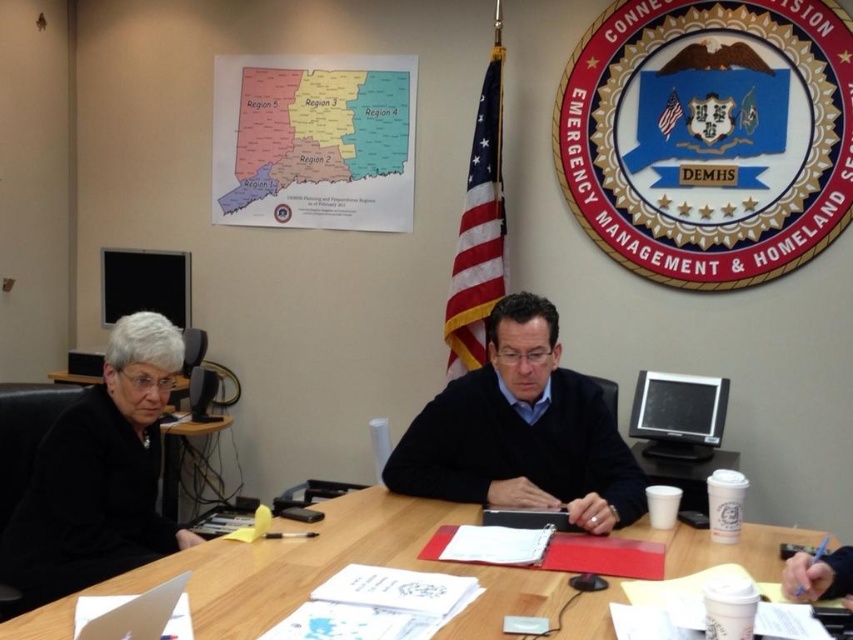
Can you confirm if black matte jacket at left is shorter than black plastic table at lower left?

Correct, black matte jacket at left is not as tall as black plastic table at lower left.

Image resolution: width=853 pixels, height=640 pixels. What do you see at coordinates (99, 474) in the screenshot? I see `black matte jacket at left` at bounding box center [99, 474].

Identify the location of black matte jacket at left. The height and width of the screenshot is (640, 853). (99, 474).

You are a GUI agent. You are given a task and a screenshot of the screen. Output one action in this format:
    pyautogui.click(x=<x>, y=<y>)
    Task: Click on the black matte jacket at left
    This screenshot has width=853, height=640.
    Given the screenshot: What is the action you would take?
    pyautogui.click(x=99, y=474)

Does point (775, 536) come in front of point (22, 600)?

No, it is behind (22, 600).

Does wooden table at center lie behind black matte jacket at left?

No, it is in front of black matte jacket at left.

In the scene shown: Who is more forward, (509,577) or (119,561)?

Point (509,577)

The height and width of the screenshot is (640, 853). In order to click on wooden table at center in this screenshot , I will do `click(339, 566)`.

Can you confirm if wooden table at center is wider than black plastic table at lower left?

Indeed, wooden table at center has a greater width compared to black plastic table at lower left.

Measure the distance between wooden table at center and camera.

A distance of 1.35 meters exists between wooden table at center and camera.

This screenshot has height=640, width=853. I want to click on wooden table at center, so click(339, 566).